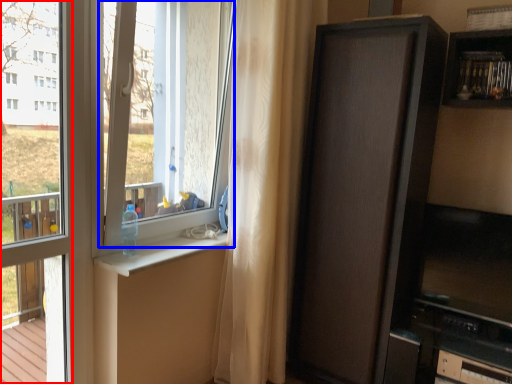
Question: Among these objects, which one is nearest to the camera, window frame (highlighted by a red box) or window screen (highlighted by a blue box)?

Choices:
 (A) window frame
 (B) window screen

Answer: (A)